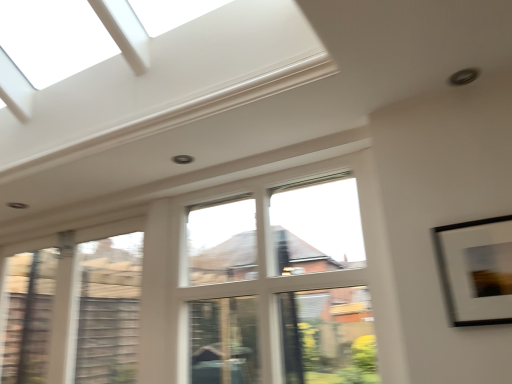
Question: In terms of size, does clear glass window at left, placed as the second window when sorted from right to left, appear bigger or smaller than white matte picture frame at upper right?

Choices:
 (A) big
 (B) small

Answer: (A)

Question: Is clear glass window at left, placed as the second window when sorted from right to left, wider or thinner than white matte picture frame at upper right?

Choices:
 (A) thin
 (B) wide

Answer: (B)

Question: Which is nearer to the clear glass window at left, placed as the second window when sorted from right to left?

Choices:
 (A) clear glass window at center, the second window positioned from the left
 (B) white matte picture frame at upper right

Answer: (A)

Question: Estimate the real-world distances between objects in this image. Which object is closer to the clear glass window at left, placed as the second window when sorted from right to left?

Choices:
 (A) clear glass window at center, acting as the 1th window starting from the right
 (B) white matte picture frame at upper right

Answer: (A)